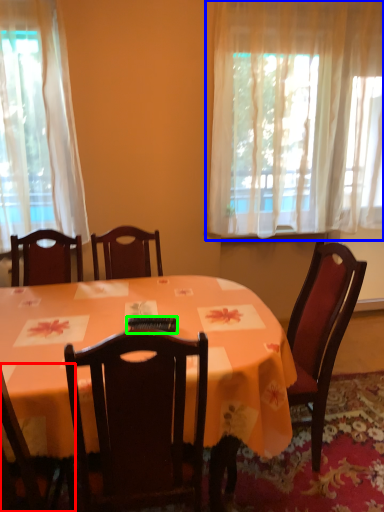
Question: Considering the real-world distances, which object is closest to chair (highlighted by a red box)? curtain (highlighted by a blue box) or remote control (highlighted by a green box).

Choices:
 (A) curtain
 (B) remote control

Answer: (B)